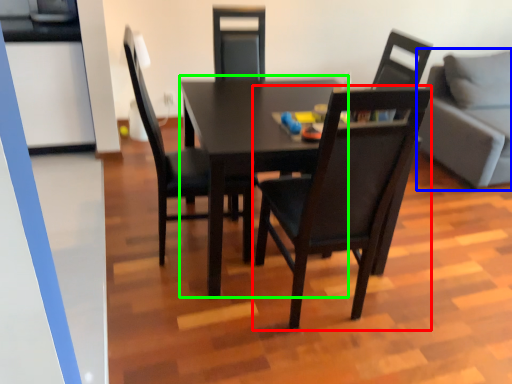
Question: Which is nearer to the chair (highlighted by a red box)? studio couch (highlighted by a blue box) or table (highlighted by a green box).

Choices:
 (A) studio couch
 (B) table

Answer: (B)